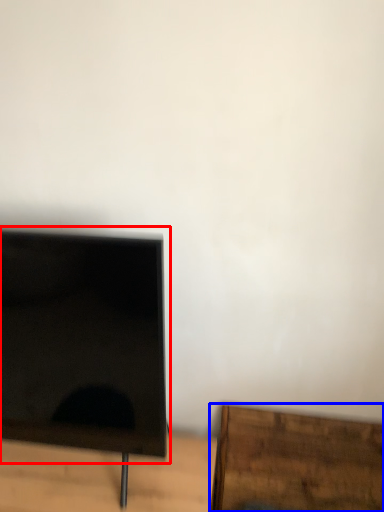
Question: Which of the following is the closest to the observer, computer monitor (highlighted by a red box) or furniture (highlighted by a blue box)?

Choices:
 (A) computer monitor
 (B) furniture

Answer: (A)